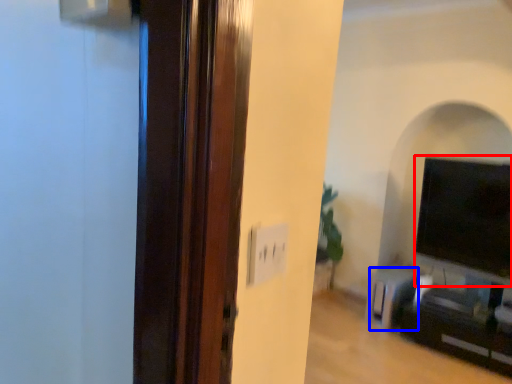
Question: Which of the following is the closest to the observer, wide (highlighted by a red box) or furniture (highlighted by a blue box)?

Choices:
 (A) wide
 (B) furniture

Answer: (A)